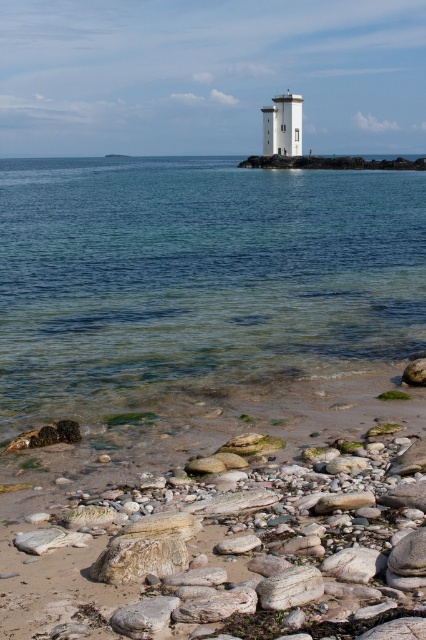
Which is in front, point (385, 589) or point (287, 144)?

Point (385, 589) is more forward.

Is point (371, 570) behind point (291, 152)?

No.

At what (x,y) coordinates should I click in order to perform the action: click on smooth white stones at lower center. Please return your answer as a coordinate pair (x, y). Looking at the image, I should click on click(204, 484).

This screenshot has width=426, height=640. What do you see at coordinates (198, 278) in the screenshot? I see `clear water at center` at bounding box center [198, 278].

Can you confirm if clear water at center is wider than white smooth tower at center?

Yes.

This screenshot has width=426, height=640. Find the location of `clear water at center`. clear water at center is located at coordinates (198, 278).

Find the location of a particular element. The image size is (426, 640). clear water at center is located at coordinates (198, 278).

What do you see at coordinates (198, 278) in the screenshot?
I see `clear water at center` at bounding box center [198, 278].

Between point (115, 394) and point (359, 476), which one is positioned in front?

Point (359, 476) is more forward.

Which is in front, point (319, 342) or point (374, 584)?

Point (374, 584) is in front.

Locate an element on the screen. Image resolution: width=426 pixels, height=640 pixels. clear water at center is located at coordinates (198, 278).